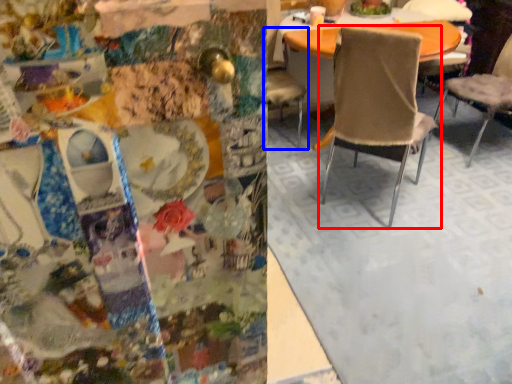
Question: Among these objects, which one is nearest to the camera, chair (highlighted by a red box) or chair (highlighted by a blue box)?

Choices:
 (A) chair
 (B) chair

Answer: (A)